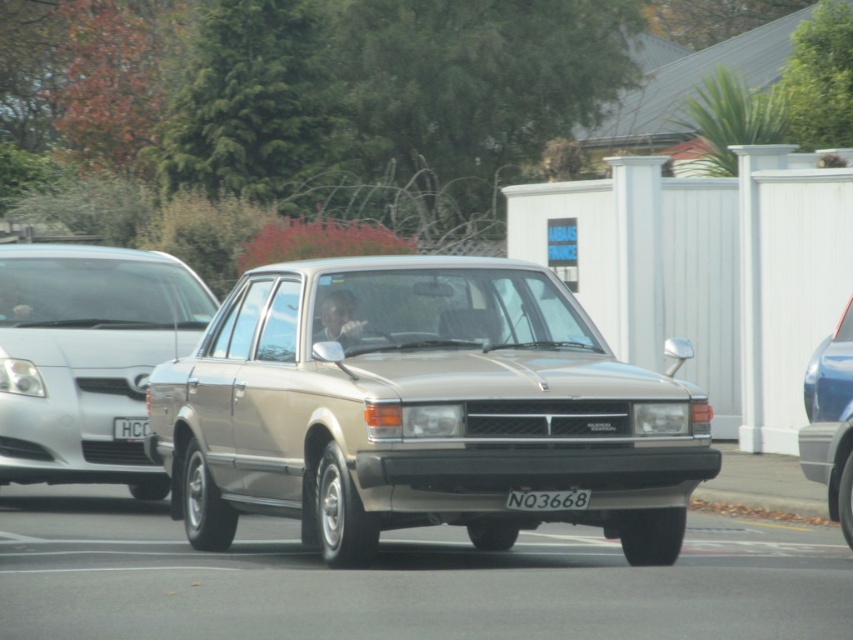
Question: Can you confirm if satin silver sedan at left is positioned to the left of white plastic license plate at center?

Choices:
 (A) no
 (B) yes

Answer: (B)

Question: Which of the following is the farthest from the observer?

Choices:
 (A) white plastic license plate at center
 (B) satin gold sedan at center
 (C) satin blue sedan at right

Answer: (A)

Question: Based on their relative distances, which object is farther from the black plastic license plate at center?

Choices:
 (A) satin blue sedan at right
 (B) white plastic license plate at center
 (C) satin silver sedan at left

Answer: (C)

Question: Is satin gold sedan at center closer to camera compared to white plastic license plate at center?

Choices:
 (A) no
 (B) yes

Answer: (B)

Question: Does black plastic license plate at center appear under white plastic license plate at center?

Choices:
 (A) yes
 (B) no

Answer: (A)

Question: Among these objects, which one is nearest to the camera?

Choices:
 (A) satin gold sedan at center
 (B) white plastic license plate at center
 (C) satin blue sedan at right

Answer: (A)